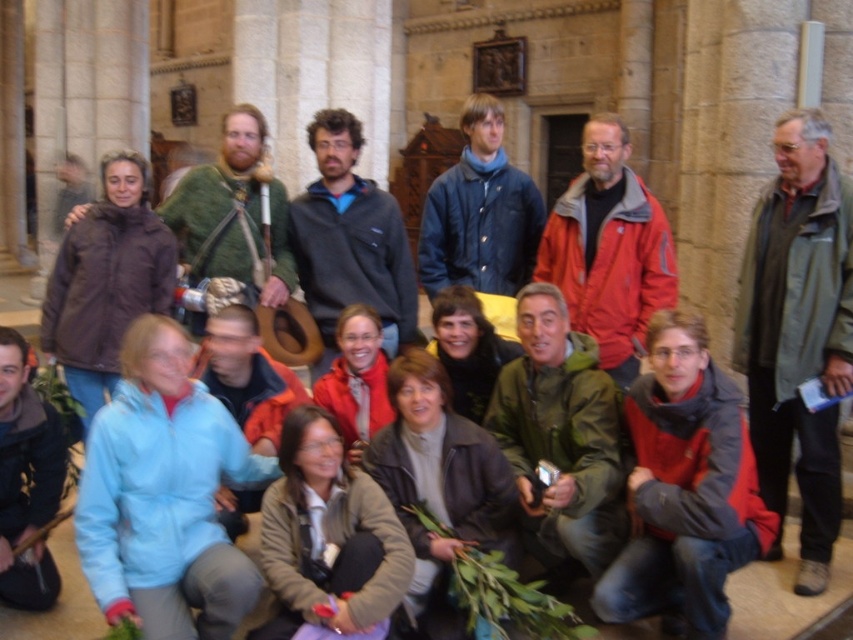
You are a tour guide standing at the entrance of the cathedral. You notice a tourist wearing a matte gray vest at center who is 29.38 meters away. Can you clearly see the tourist from your position?

The matte gray vest at center and viewer are 29.38 meters apart, so yes, the tour guide can clearly see the tourist wearing the matte gray vest at center from their position at the entrance as the distance is within a typical visibility range in such a space.

You are a tour guide leading a group in a cathedral. You notice two people wearing green clothing. The first is wearing a green matte jacket at right, and the second is wearing a green wool sweater at center. Which of these two is standing more to the right side of the group?

The green matte jacket at right is positioned on the right side of the green wool sweater at center, so the green matte jacket at right is standing more to the right side of the group.